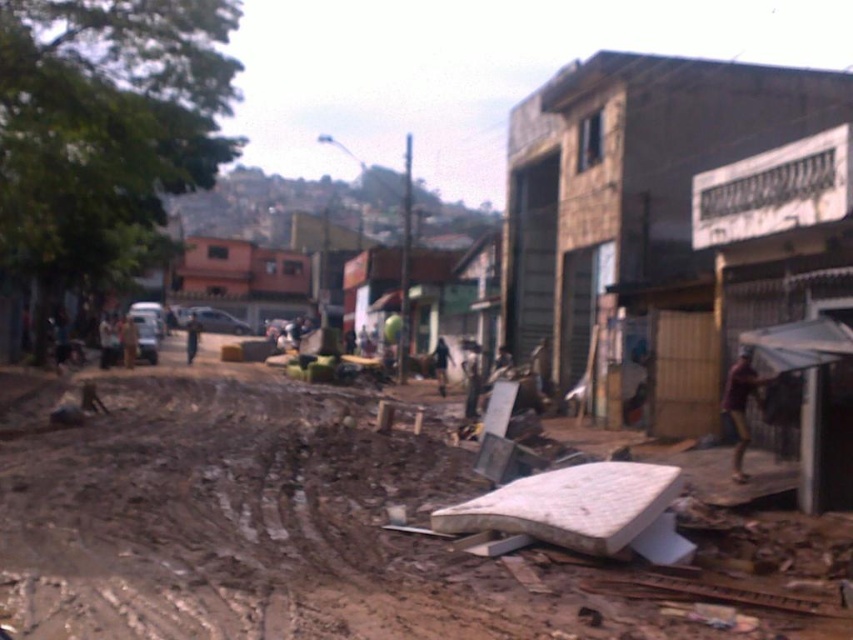
You are a delivery person trying to navigate through the disaster area shown in the image. You see the brown dirt at lower center and the dark skin human at center. Which object is lower in height?

The brown dirt at lower center is shorter than the dark skin human at center, so the brown dirt at lower center is lower in height.

You are a delivery person trying to navigate through the debris on the muddy street. You see a brown fabric shirt at right and a brown leather jacket at center. Which item takes up more space on the ground?

The brown leather jacket at center takes up more space on the ground than the brown fabric shirt at right because the brown fabric shirt at right occupies less space than brown leather jacket at center.

You are a delivery person trying to navigate through the debris on the muddy street. You notice a brown fabric shirt at right and a brown leather jacket at center. Which item is closer to your current position?

The brown fabric shirt at right is shorter than the brown leather jacket at center, so the brown fabric shirt at right is closer to your current position.